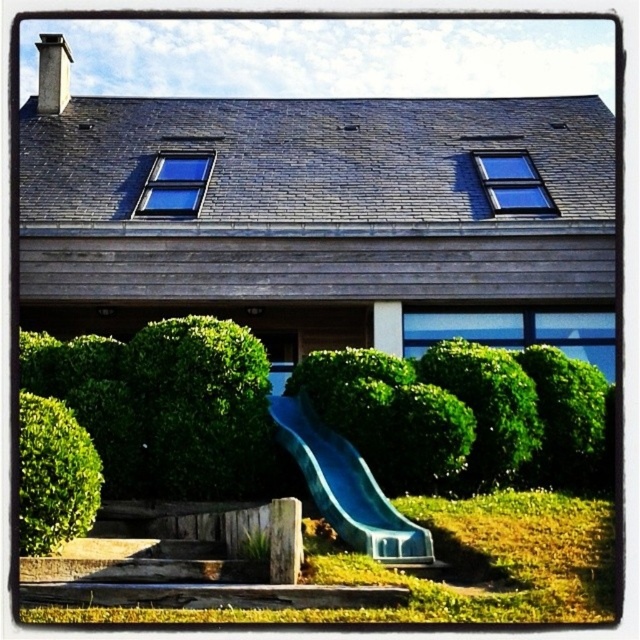
Question: Among these points, which one is farthest from the camera?

Choices:
 (A) (76, 458)
 (B) (349, 525)

Answer: (B)

Question: Can you confirm if blue plastic slide at center is thinner than green leafy bush at lower left?

Choices:
 (A) yes
 (B) no

Answer: (B)

Question: Which object appears closest to the camera in this image?

Choices:
 (A) green leafy bush at lower left
 (B) blue plastic slide at center

Answer: (A)

Question: Can you confirm if blue plastic slide at center is thinner than green leafy bush at lower left?

Choices:
 (A) no
 (B) yes

Answer: (A)

Question: Does blue plastic slide at center have a lesser width compared to green leafy bush at lower left?

Choices:
 (A) no
 (B) yes

Answer: (A)